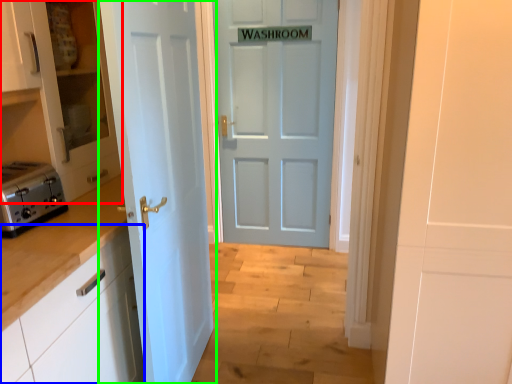
Question: Considering the real-world distances, which object is farthest from cabinetry (highlighted by a red box)? cabinetry (highlighted by a blue box) or door (highlighted by a green box)?

Choices:
 (A) cabinetry
 (B) door

Answer: (A)